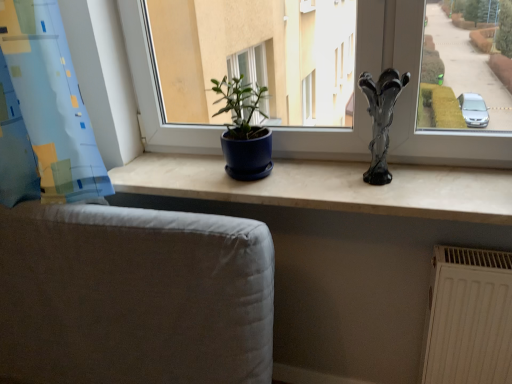
This screenshot has height=384, width=512. Find the location of `free location in front of transparent glass vase at right`. free location in front of transparent glass vase at right is located at coordinates (395, 197).